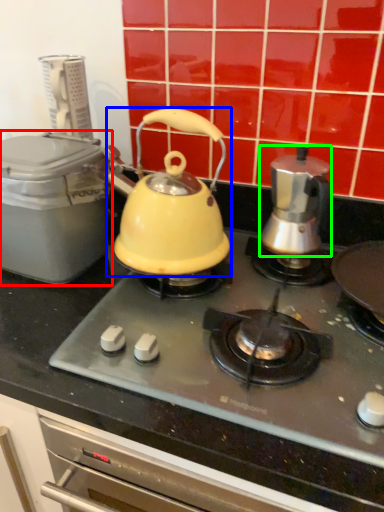
Question: Based on their relative distances, which object is nearer to kitchen appliance (highlighted by a red box)? Choose from kettle (highlighted by a blue box) and kettle (highlighted by a green box).

Choices:
 (A) kettle
 (B) kettle

Answer: (A)